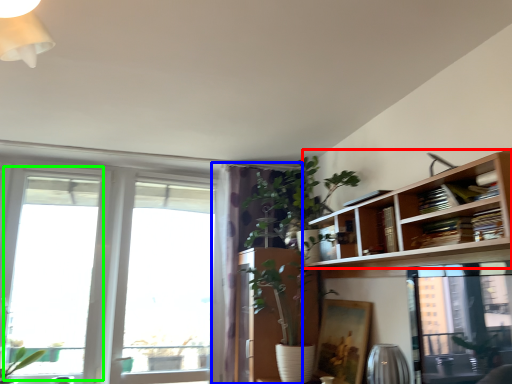
Question: Which is nearer to the bookshelf (highlighted by a red box)? curtain (highlighted by a blue box) or window (highlighted by a green box).

Choices:
 (A) curtain
 (B) window

Answer: (A)